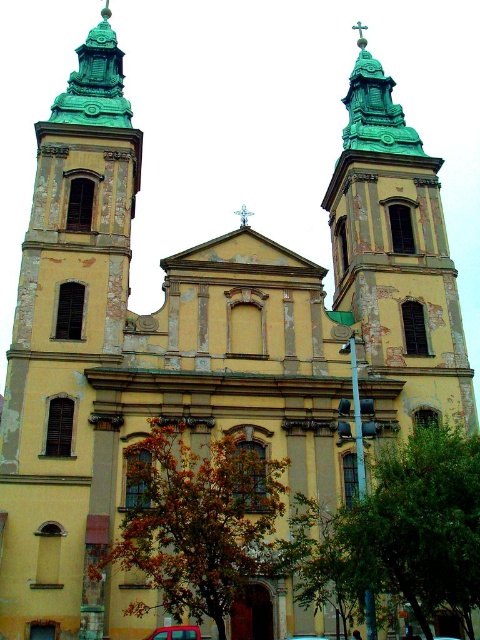
Does metallic red car at lower center have a larger size compared to metallic blue car at center?

Indeed, metallic red car at lower center has a larger size compared to metallic blue car at center.

Between point (182, 632) and point (295, 636), which one is positioned behind?

The point (295, 636) is behind.

The height and width of the screenshot is (640, 480). I want to click on metallic red car at lower center, so click(176, 632).